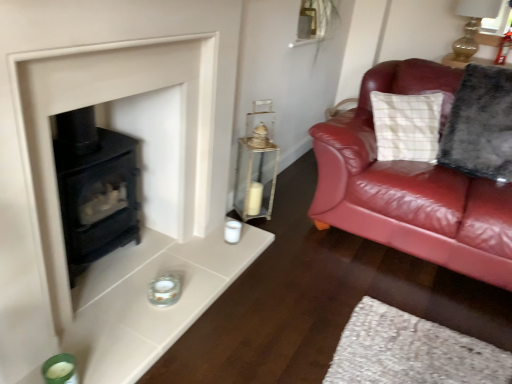
Question: Is gold glass oil lamp at upper right not within matte black stove at lower left?

Choices:
 (A) no
 (B) yes

Answer: (B)

Question: From the image's perspective, does gold glass oil lamp at upper right appear higher than matte black stove at lower left?

Choices:
 (A) yes
 (B) no

Answer: (A)

Question: Can you confirm if gold glass oil lamp at upper right is positioned to the left of matte black stove at lower left?

Choices:
 (A) yes
 (B) no

Answer: (B)

Question: From a real-world perspective, does gold glass oil lamp at upper right sit lower than matte black stove at lower left?

Choices:
 (A) yes
 (B) no

Answer: (B)

Question: Does gold glass oil lamp at upper right come in front of matte black stove at lower left?

Choices:
 (A) no
 (B) yes

Answer: (A)

Question: Is gold glass oil lamp at upper right facing towards matte black stove at lower left?

Choices:
 (A) no
 (B) yes

Answer: (B)

Question: From a real-world perspective, is matte glass candle holder at lower center, which appears as the 2th candle holder when viewed from the front, physically below gold glass oil lamp at upper right?

Choices:
 (A) no
 (B) yes

Answer: (B)

Question: Is matte glass candle holder at lower center, which appears as the 2th candle holder when viewed from the front, positioned behind gold glass oil lamp at upper right?

Choices:
 (A) yes
 (B) no

Answer: (B)

Question: Is matte glass candle holder at lower center, which is the 2th candle holder in bottom-to-top order, completely or partially outside of gold glass oil lamp at upper right?

Choices:
 (A) no
 (B) yes

Answer: (B)

Question: From the image's perspective, is matte glass candle holder at lower center, which is the 2th candle holder in bottom-to-top order, on gold glass oil lamp at upper right?

Choices:
 (A) no
 (B) yes

Answer: (A)

Question: Considering the relative sizes of matte glass candle holder at lower center, which ranks as the 1th candle holder in top-to-bottom order, and gold glass oil lamp at upper right in the image provided, is matte glass candle holder at lower center, which ranks as the 1th candle holder in top-to-bottom order, thinner than gold glass oil lamp at upper right?

Choices:
 (A) no
 (B) yes

Answer: (B)

Question: Can you confirm if matte glass candle holder at lower center, which ranks as the 1th candle holder in top-to-bottom order, is positioned to the left of gold glass oil lamp at upper right?

Choices:
 (A) yes
 (B) no

Answer: (A)

Question: From a real-world perspective, does fluffy gray pillow at right sit lower than green glass candle holder at lower left, which ranks as the 1th candle holder in front-to-back order?

Choices:
 (A) no
 (B) yes

Answer: (A)